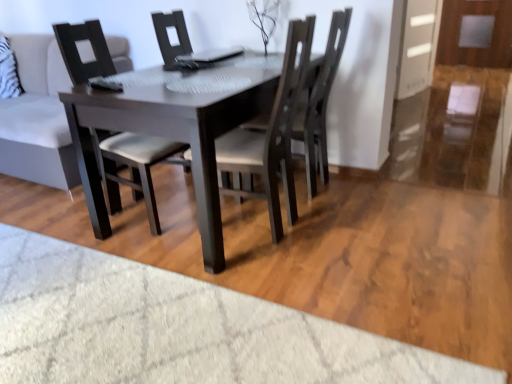
Where is `free space in front of dark brown wood table at center`? free space in front of dark brown wood table at center is located at coordinates (219, 308).